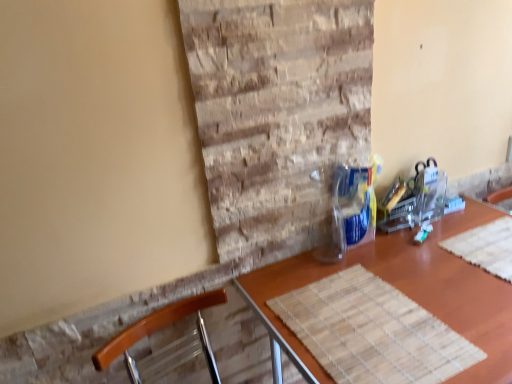
Question: Considering the positions of point (210, 354) and point (303, 347), is point (210, 354) closer or farther from the camera than point (303, 347)?

Choices:
 (A) farther
 (B) closer

Answer: (A)

Question: From a real-world perspective, is wooden chair at lower left physically located above or below wooden placemat at center?

Choices:
 (A) below
 (B) above

Answer: (B)

Question: In the image, is wooden chair at lower left on the left side or the right side of wooden placemat at center?

Choices:
 (A) right
 (B) left

Answer: (B)

Question: Looking at their shapes, would you say wooden placemat at center is wider or thinner than wooden chair at lower left?

Choices:
 (A) thin
 (B) wide

Answer: (B)

Question: Which is correct: wooden placemat at center is inside wooden chair at lower left, or outside of it?

Choices:
 (A) outside
 (B) inside

Answer: (A)

Question: From a real-world perspective, is wooden placemat at center positioned above or below wooden chair at lower left?

Choices:
 (A) above
 (B) below

Answer: (B)

Question: Is wooden placemat at center bigger or smaller than wooden chair at lower left?

Choices:
 (A) small
 (B) big

Answer: (B)